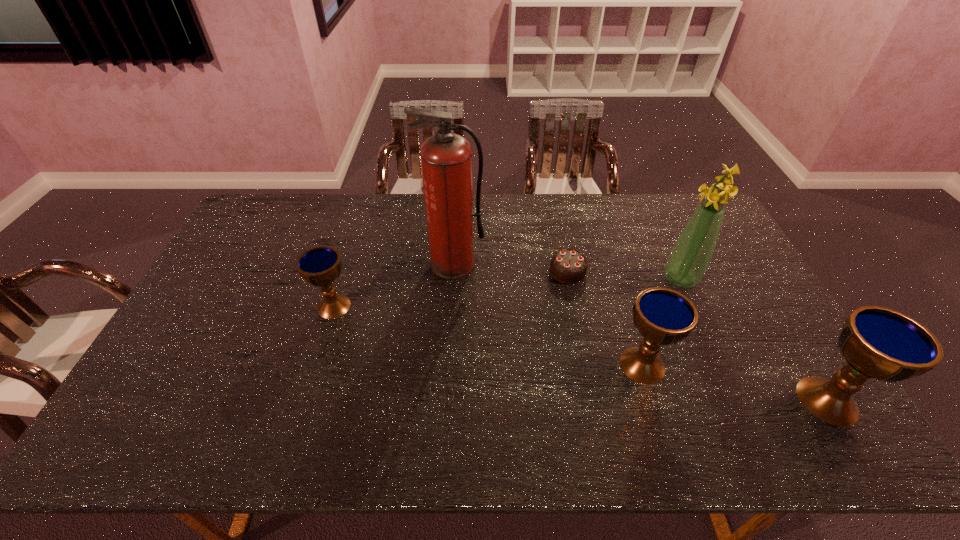
The image size is (960, 540). I want to click on free space that satisfies the following two spatial constraints: 1. on the front side of the second tallest chalice; 2. on the left side of the fifth tallest object, so click(316, 365).

This screenshot has width=960, height=540. Find the location of `free space that satisfies the following two spatial constraints: 1. at the nozzle of the tallest object; 2. on the right side of the fourth object from right to left`. free space that satisfies the following two spatial constraints: 1. at the nozzle of the tallest object; 2. on the right side of the fourth object from right to left is located at coordinates (453, 271).